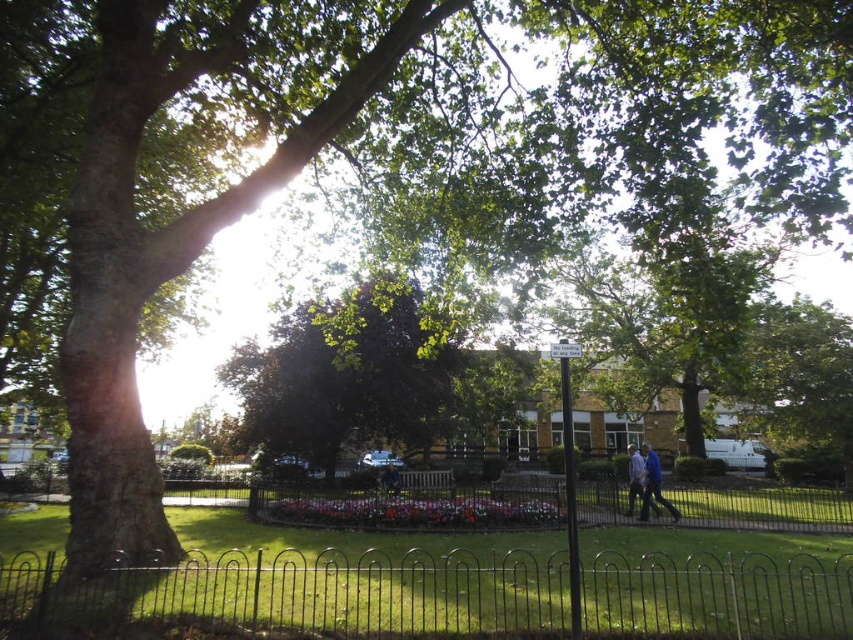
You are standing in the park and want to locate the black metal fence at lower center. According to the coordinates provided, where would you find point (305, 593) in relation to the black metal fence at lower center?

Point (305, 593) is on the black metal fence at lower center.

You are standing in the park and see the green leafy tree at center and the blue fabric jacket at center. Which object is closer to you?

The green leafy tree at center is closer to the viewer than the blue fabric jacket at center.